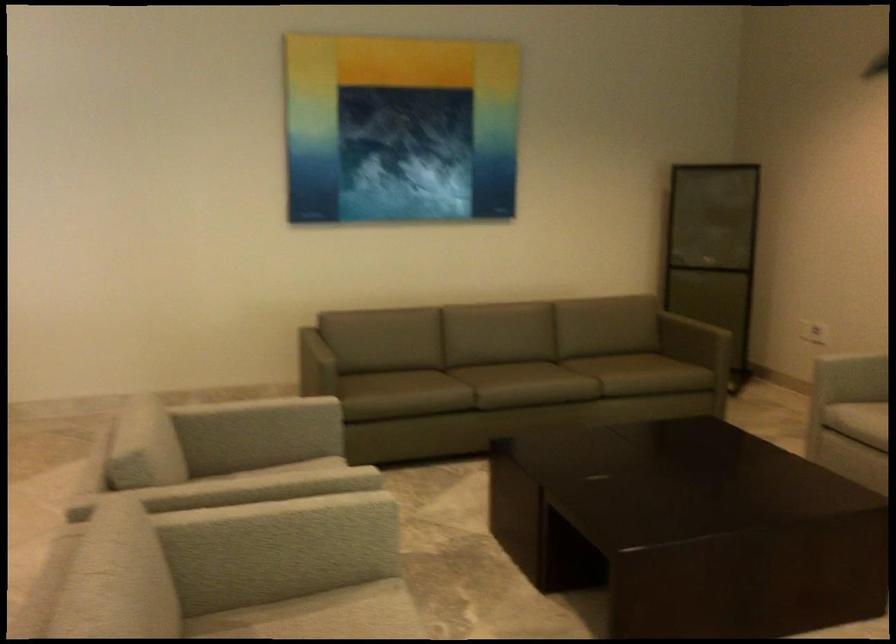
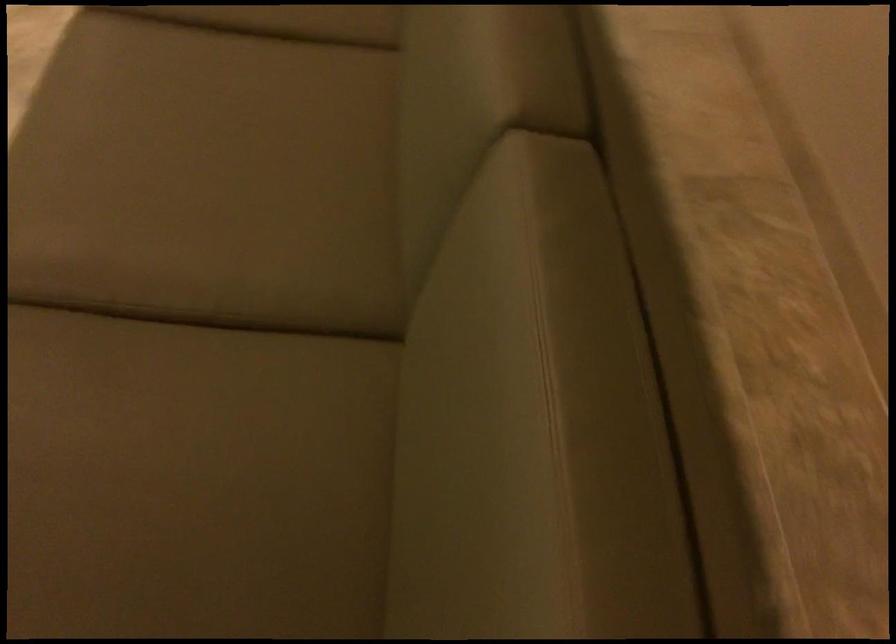
In the second image, find the point that corresponds to [416,374] in the first image.

(286, 20)